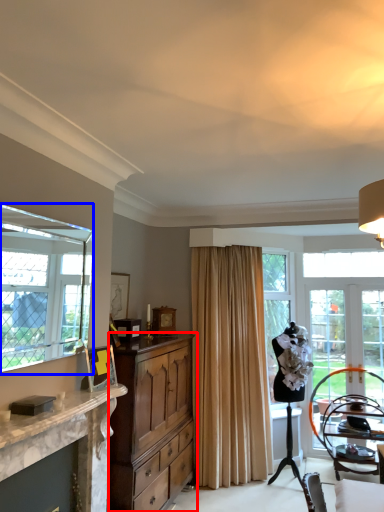
Question: Among these objects, which one is farthest to the camera, cabinetry (highlighted by a red box) or window (highlighted by a blue box)?

Choices:
 (A) cabinetry
 (B) window

Answer: (A)